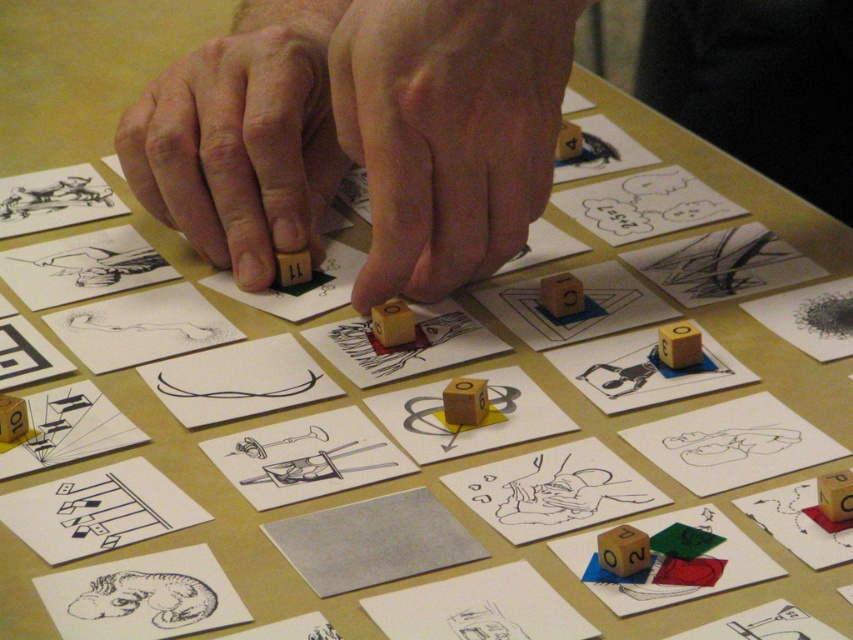
You are looking at the tabletop game setup. There are two points marked on the image at coordinates point (482,96) and point (149,588). Which point is closer to you?

Point (482,96) is further to the camera than point (149,588), so the point closer to you is point (149,588).

You are playing a tabletop game and need to place a die on the closest object to you between the wooden block at center and the black textured dinosaur at bottom left. Which object should you choose?

The wooden block at center is closer to you than the black textured dinosaur at bottom left, so you should place the die on the wooden block at center.

Where is the wooden at center located in terms of its 2D coordinates?

The wooden at center is located at the 2D coordinates of point [448,131].